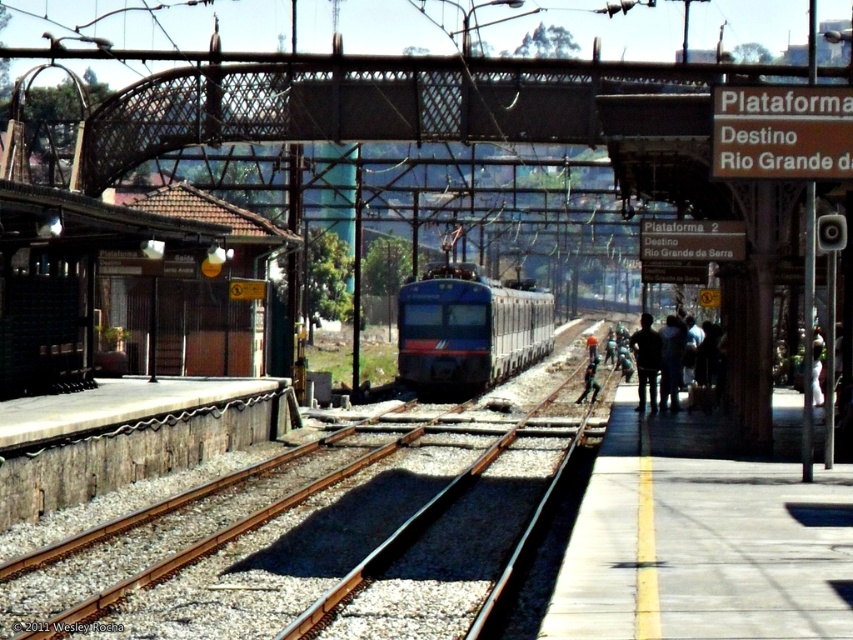
Is smooth metal track at center wider than dark blue uniform at center?

Correct, the width of smooth metal track at center exceeds that of dark blue uniform at center.

Is point (303, 540) closer to viewer compared to point (636, 360)?

That is True.

This screenshot has height=640, width=853. Find the location of `smooth metal track at center`. smooth metal track at center is located at coordinates (328, 532).

Describe the element at coordinates (469, 330) in the screenshot. I see `blue glossy train at center` at that location.

Does blue glossy train at center appear on the right side of dark blue uniform at center?

Incorrect, blue glossy train at center is not on the right side of dark blue uniform at center.

Which is behind, point (543, 298) or point (639, 408)?

The point (543, 298) is behind.

At what (x,y) coordinates should I click in order to perform the action: click on blue glossy train at center. Please return your answer as a coordinate pair (x, y). The width and height of the screenshot is (853, 640). Looking at the image, I should click on (469, 330).

From the picture: Does concrete platform at right come in front of blue glossy train at center?

That is True.

Does concrete platform at right have a greater height compared to blue glossy train at center?

No.

The width and height of the screenshot is (853, 640). Find the location of `concrete platform at right`. concrete platform at right is located at coordinates [x=701, y=547].